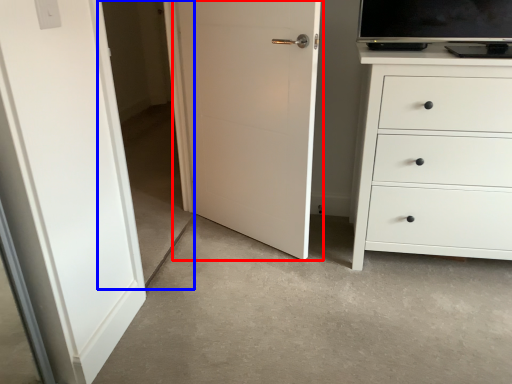
Question: Which point is further to the camera, door (highlighted by a red box) or glass door (highlighted by a blue box)?

Choices:
 (A) door
 (B) glass door

Answer: (A)